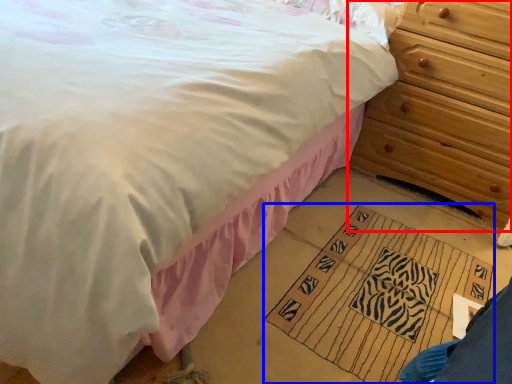
Question: Which object is closer to the camera taking this photo, chest of drawers (highlighted by a red box) or doormat (highlighted by a blue box)?

Choices:
 (A) chest of drawers
 (B) doormat

Answer: (B)